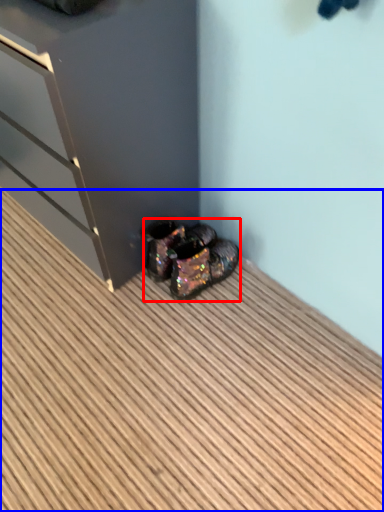
Question: Which of the following is the closest to the observer, footwear (highlighted by a red box) or hardwood (highlighted by a blue box)?

Choices:
 (A) footwear
 (B) hardwood

Answer: (B)